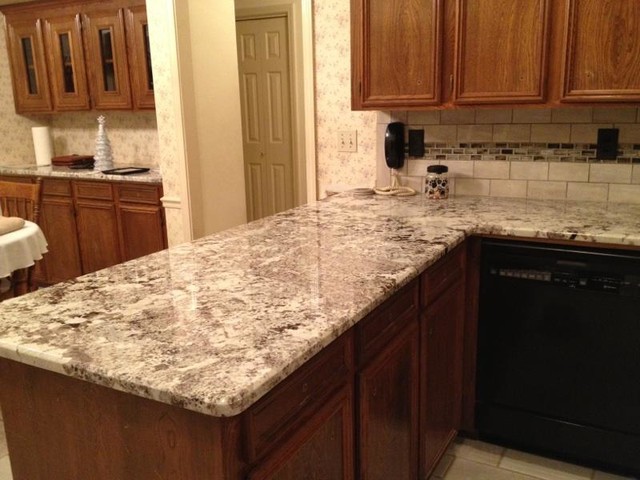
Find the location of a particular element. pickup telephone is located at coordinates (390, 147).